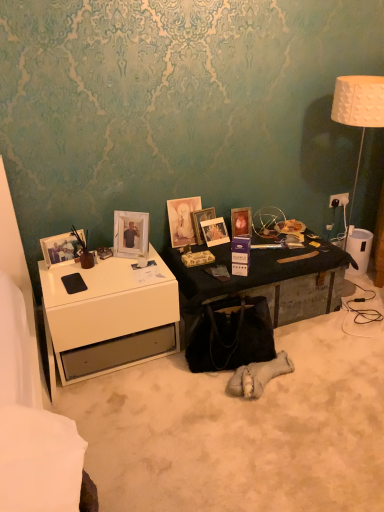
Question: Is white plastic power outlet at upper right not close to wooden photo frame at center, the fifth picture frame positioned from the left?

Choices:
 (A) yes
 (B) no

Answer: (B)

Question: Is white plastic power outlet at upper right directly adjacent to wooden photo frame at center, the fifth picture frame positioned from the left?

Choices:
 (A) yes
 (B) no

Answer: (B)

Question: Is white plastic power outlet at upper right turned away from wooden photo frame at center, the 2th picture frame positioned from the right?

Choices:
 (A) no
 (B) yes

Answer: (A)

Question: From the image's perspective, does white plastic power outlet at upper right appear higher than wooden photo frame at center, the fifth picture frame positioned from the left?

Choices:
 (A) yes
 (B) no

Answer: (A)

Question: Is white plastic power outlet at upper right at the right side of wooden photo frame at center, the 2th picture frame positioned from the right?

Choices:
 (A) yes
 (B) no

Answer: (A)

Question: Is wooden photo frame at center, the 2th picture frame positioned from the right, surrounded by white plastic power outlet at upper right?

Choices:
 (A) yes
 (B) no

Answer: (B)

Question: From the image's perspective, is white glossy picture frame at upper left, which is the 5th picture frame from right to left, on wooden photo frame at center, the 2th picture frame positioned from the right?

Choices:
 (A) no
 (B) yes

Answer: (A)

Question: Could you tell me if white glossy picture frame at upper left, arranged as the second picture frame when viewed from the left, is turned towards wooden photo frame at center, the 2th picture frame positioned from the right?

Choices:
 (A) no
 (B) yes

Answer: (A)

Question: Considering the relative positions of white glossy picture frame at upper left, which is the 5th picture frame from right to left, and wooden photo frame at center, the 2th picture frame positioned from the right, in the image provided, is white glossy picture frame at upper left, which is the 5th picture frame from right to left, to the right of wooden photo frame at center, the 2th picture frame positioned from the right, from the viewer's perspective?

Choices:
 (A) no
 (B) yes

Answer: (A)

Question: Can you confirm if white glossy picture frame at upper left, arranged as the second picture frame when viewed from the left, is shorter than wooden photo frame at center, the 2th picture frame positioned from the right?

Choices:
 (A) no
 (B) yes

Answer: (A)

Question: From the image's perspective, is white glossy picture frame at upper left, arranged as the second picture frame when viewed from the left, located beneath wooden photo frame at center, the fifth picture frame positioned from the left?

Choices:
 (A) no
 (B) yes

Answer: (B)

Question: Considering the relative sizes of white glossy picture frame at upper left, which is the 5th picture frame from right to left, and wooden photo frame at center, the fifth picture frame positioned from the left, in the image provided, is white glossy picture frame at upper left, which is the 5th picture frame from right to left, smaller than wooden photo frame at center, the fifth picture frame positioned from the left,?

Choices:
 (A) no
 (B) yes

Answer: (A)

Question: Is wooden photo frame at center, the 2th picture frame positioned from the right, thinner than black suede handbag at center?

Choices:
 (A) yes
 (B) no

Answer: (A)